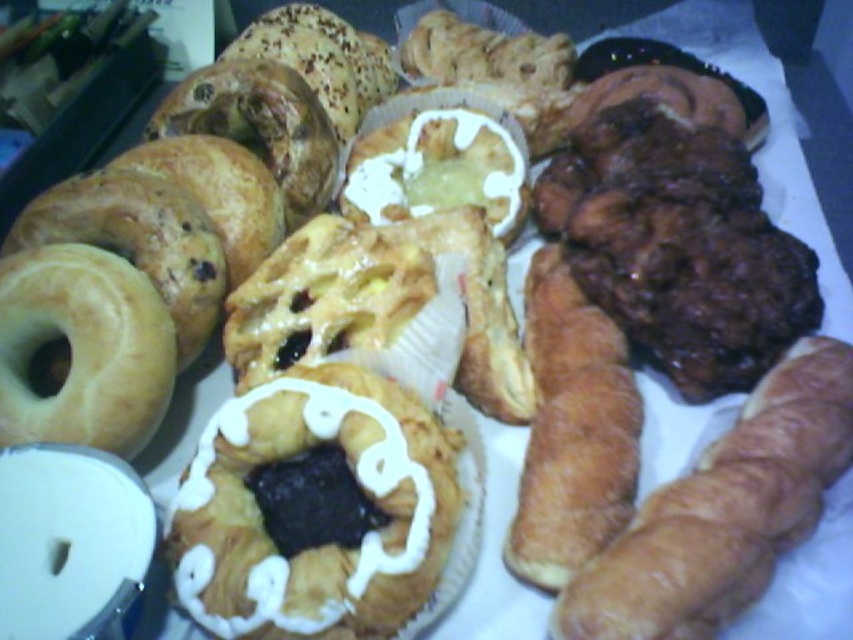
Question: Observing the image, what is the correct spatial positioning of golden brown croissant at lower right in reference to golden brown flaky croissant at center-right?

Choices:
 (A) right
 (B) left

Answer: (A)

Question: In this image, where is glazed doughnut at center located relative to golden glazed donut at left?

Choices:
 (A) above
 (B) below

Answer: (B)

Question: Which point is closer to the camera taking this photo?

Choices:
 (A) (781, 394)
 (B) (584, 300)
 (C) (286, 385)

Answer: (C)

Question: Is golden brown croissant at lower right smaller than golden brown flaky croissant at center-right?

Choices:
 (A) no
 (B) yes

Answer: (A)

Question: Which point is closer to the camera?

Choices:
 (A) (88, 273)
 (B) (268, 406)
 (C) (572, 397)

Answer: (B)

Question: Which object is the farthest from the golden glazed donut at left?

Choices:
 (A) golden brown croissant at lower right
 (B) golden brown flaky croissant at center-right

Answer: (A)